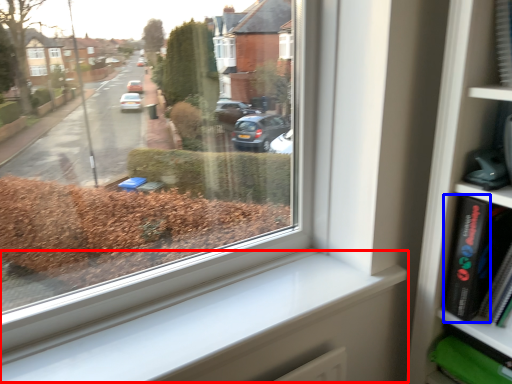
Question: Among these objects, which one is nearest to the camera, window sill (highlighted by a red box) or paperback book (highlighted by a blue box)?

Choices:
 (A) window sill
 (B) paperback book

Answer: (A)